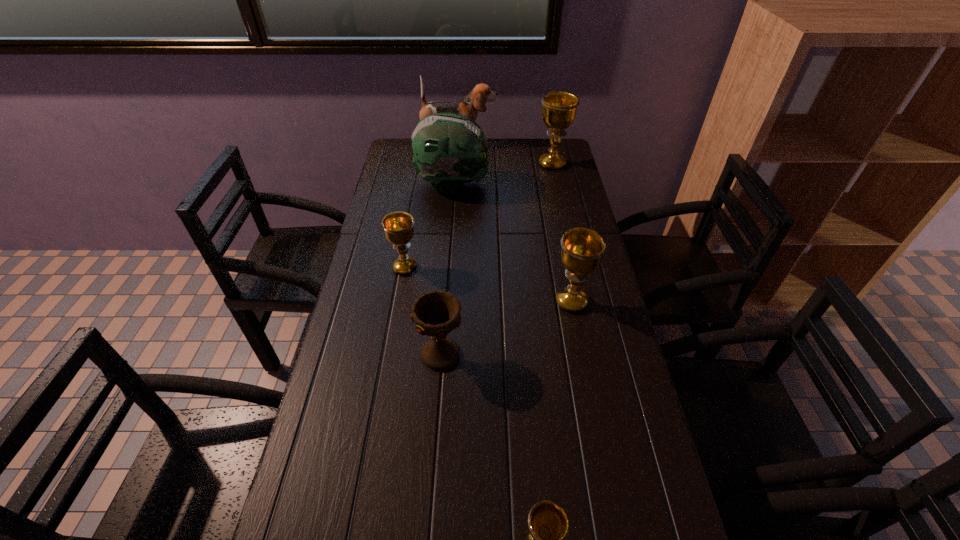
At what (x,y) coordinates should I click in order to perform the action: click on football helmet that is at the left edge. Please return your answer as a coordinate pair (x, y). Looking at the image, I should click on (450, 149).

Find the location of a particular element. Image resolution: width=960 pixels, height=540 pixels. chalice present at the left edge is located at coordinates (398, 227).

Find the location of a particular element. Image resolution: width=960 pixels, height=540 pixels. object located in the far left corner section of the desktop is located at coordinates (469, 106).

Find the location of `object at the far right corner`. object at the far right corner is located at coordinates (559, 108).

You are a GUI agent. You are given a task and a screenshot of the screen. Output one action in this format:
    pyautogui.click(x=<x>, y=<y>)
    Task: Click on the blank space at the left edge of the desktop
    The width and height of the screenshot is (960, 540).
    Given the screenshot: What is the action you would take?
    pyautogui.click(x=398, y=195)

In the image, there is a desktop. At what (x,y) coordinates should I click in order to perform the action: click on vacant space at the right edge. Please return your answer as a coordinate pair (x, y). This screenshot has width=960, height=540. Looking at the image, I should click on (553, 174).

The width and height of the screenshot is (960, 540). Identify the location of vacant space at the far left corner. (413, 168).

Locate an element on the screen. free spot between the football helmet and the third farthest gold chalice is located at coordinates (512, 243).

The image size is (960, 540). In order to click on blank region between the second nearest object and the fourth shortest chalice in this screenshot , I will do `click(506, 328)`.

At what (x,y) coordinates should I click in order to perform the action: click on unoccupied area between the brown puppy and the biggest gold chalice. Please return your answer as a coordinate pair (x, y). The width and height of the screenshot is (960, 540). Looking at the image, I should click on (505, 154).